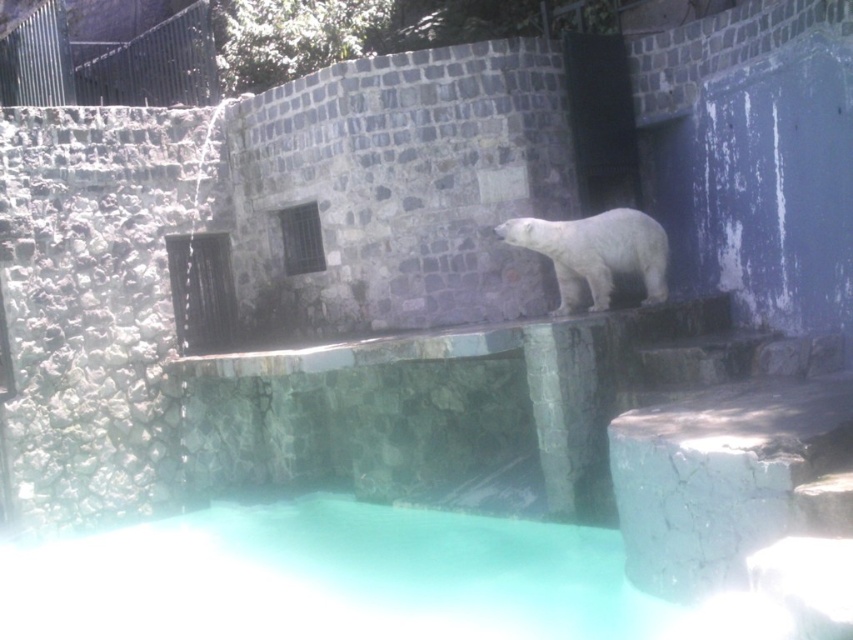
Question: Can you confirm if smooth concrete ledge at center is wider than white fur bear at center?

Choices:
 (A) yes
 (B) no

Answer: (B)

Question: Among these objects, which one is farthest from the camera?

Choices:
 (A) white fur bear at center
 (B) smooth concrete ledge at center

Answer: (B)

Question: Which point is farther to the camera?

Choices:
 (A) smooth concrete ledge at center
 (B) white fur bear at center

Answer: (A)

Question: From the image, what is the correct spatial relationship of smooth concrete ledge at center in relation to white fur bear at center?

Choices:
 (A) below
 (B) above

Answer: (A)

Question: Does smooth concrete ledge at center have a greater width compared to white fur bear at center?

Choices:
 (A) yes
 (B) no

Answer: (B)

Question: Which point is closer to the camera?

Choices:
 (A) white fur bear at center
 (B) smooth concrete ledge at center

Answer: (A)